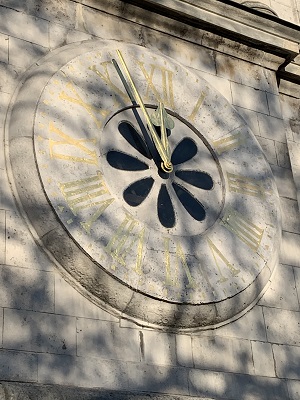
Where is `face of clock`? This screenshot has height=400, width=300. face of clock is located at coordinates (134, 209).